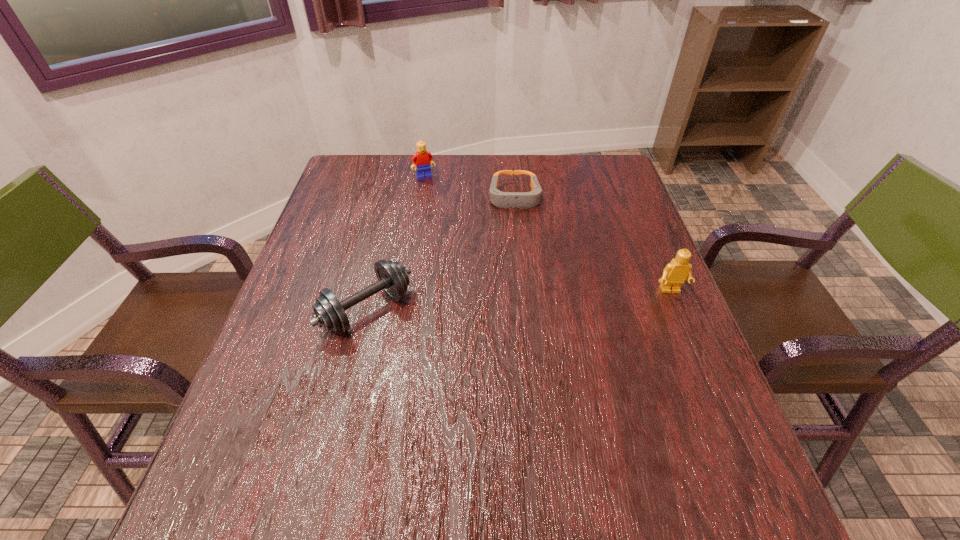
In the image, there is a desktop. Where is `vacant space at the left edge`? This screenshot has height=540, width=960. vacant space at the left edge is located at coordinates (315, 270).

Image resolution: width=960 pixels, height=540 pixels. I want to click on vacant region at the right edge of the desktop, so click(x=625, y=210).

You are a GUI agent. You are given a task and a screenshot of the screen. Output one action in this format:
    pyautogui.click(x=<x>, y=<y>)
    Task: Click on the vacant space at the far left corner of the desktop
    This screenshot has width=960, height=540.
    Given the screenshot: What is the action you would take?
    pyautogui.click(x=382, y=167)

In the image, there is a desktop. At what (x,y) coordinates should I click in order to perform the action: click on free space at the near left corner. Please return your answer as a coordinate pair (x, y). This screenshot has height=540, width=960. Looking at the image, I should click on (302, 448).

Locate an element on the screen. The height and width of the screenshot is (540, 960). vacant space at the far right corner of the desktop is located at coordinates (577, 195).

Locate an element on the screen. This screenshot has height=540, width=960. free space between the shortest object and the right Lego is located at coordinates (592, 244).

At what (x,y) coordinates should I click in order to perform the action: click on vacant area that lies between the farthest object and the third tallest object. Please return your answer as a coordinate pair (x, y). The image size is (960, 540). Looking at the image, I should click on (396, 244).

Locate an element on the screen. The width and height of the screenshot is (960, 540). free space between the farthest object and the shortest object is located at coordinates (469, 187).

I want to click on free space that is in between the nearer Lego and the second farthest object, so click(x=592, y=244).

The image size is (960, 540). What are the coordinates of `vacant point located between the farthest object and the third object from left to right` in the screenshot? It's located at (469, 187).